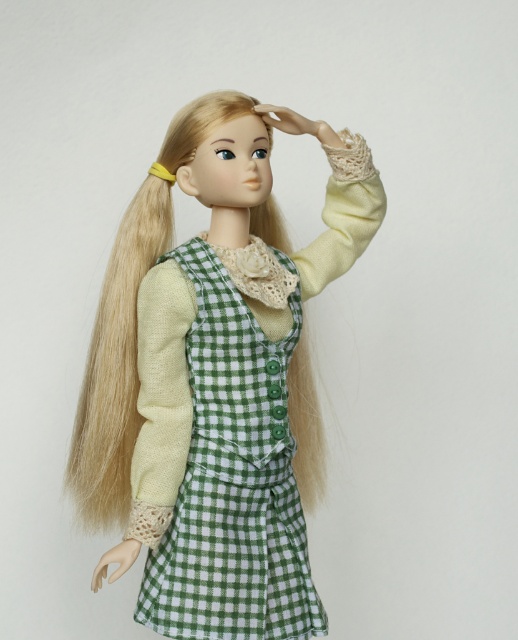
Which is in front, point (195, 541) or point (194, 596)?

Point (194, 596) is in front.

Between green checkered dress at center and green checkered apron at center, which one is positioned lower?

green checkered apron at center

Where is `green checkered dress at center`? green checkered dress at center is located at coordinates (215, 378).